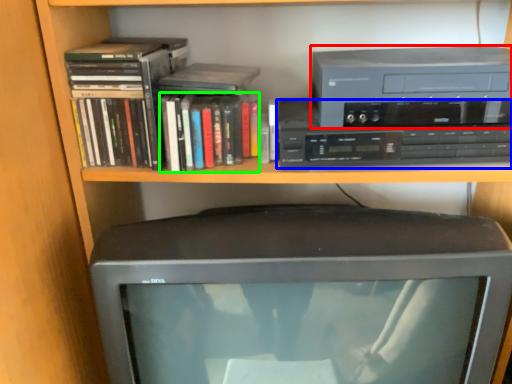
Question: Which is farther away from cassette (highlighted by a red box)? cassette (highlighted by a blue box) or book (highlighted by a green box)?

Choices:
 (A) cassette
 (B) book

Answer: (B)